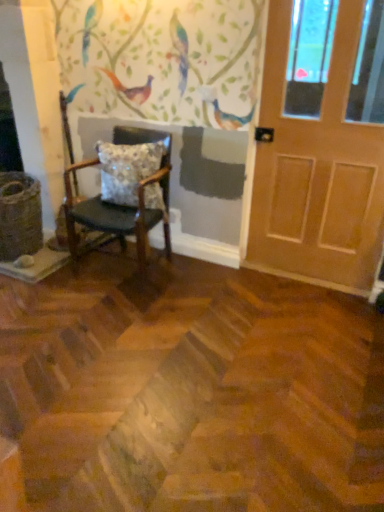
In order to click on wooden chair with cushion at left in this screenshot , I will do `click(121, 206)`.

The height and width of the screenshot is (512, 384). Find the location of `light brown wooden door at right`. light brown wooden door at right is located at coordinates (x=317, y=172).

Is the position of light brown wooden door at right less distant than that of wooden chair with cushion at left?

Yes, light brown wooden door at right is closer to the camera.

Is wooden chair with cushion at left at the back of light brown wooden door at right?

No, light brown wooden door at right's orientation is not away from wooden chair with cushion at left.

In the scene shown: Is light brown wooden door at right taller than wooden chair with cushion at left?

Indeed, light brown wooden door at right has a greater height compared to wooden chair with cushion at left.

Which object is positioned more to the right, light brown wooden door at right or wooden chair with cushion at left?

→ Positioned to the right is light brown wooden door at right.

From a real-world perspective, between wooden chair with cushion at left and floral-patterned fabric pillow at center, who is vertically lower?

wooden chair with cushion at left.

How many degrees apart are the facing directions of wooden chair with cushion at left and floral-patterned fabric pillow at center?

The angular difference between wooden chair with cushion at left and floral-patterned fabric pillow at center is 0.000318 degrees.

Consider the image. Does wooden chair with cushion at left lie behind floral-patterned fabric pillow at center?

No, it is in front of floral-patterned fabric pillow at center.

In the scene shown: Could you tell me if wooden chair with cushion at left is facing floral-patterned fabric pillow at center?

Yes, wooden chair with cushion at left is oriented towards floral-patterned fabric pillow at center.

Is floral-patterned fabric pillow at center positioned with its back to light brown wooden door at right?

No, floral-patterned fabric pillow at center is not facing away from light brown wooden door at right.

Does floral-patterned fabric pillow at center have a larger size compared to light brown wooden door at right?

No, floral-patterned fabric pillow at center is not bigger than light brown wooden door at right.

Is point (161, 146) positioned before point (257, 199)?

Yes, point (161, 146) is in front of point (257, 199).

From the image's perspective, is floral-patterned fabric pillow at center positioned above or below light brown wooden door at right?

floral-patterned fabric pillow at center is below light brown wooden door at right.

What's the angular difference between light brown wooden door at right and floral-patterned fabric pillow at center's facing directions?

The angle between the facing direction of light brown wooden door at right and the facing direction of floral-patterned fabric pillow at center is 1.77 degrees.

Find the location of `pillow below the light brown wooden door at right (from the image's perspective)`. pillow below the light brown wooden door at right (from the image's perspective) is located at coordinates (127, 169).

Would you say light brown wooden door at right is inside or outside floral-patterned fabric pillow at center?

The correct answer is: outside.

From the image's perspective, between floral-patterned fabric pillow at center and wooden chair with cushion at left, which one is located above?

floral-patterned fabric pillow at center is shown above in the image.

Could you tell me if floral-patterned fabric pillow at center is turned towards wooden chair with cushion at left?

Yes, floral-patterned fabric pillow at center faces towards wooden chair with cushion at left.

Which object is closer to the camera taking this photo, floral-patterned fabric pillow at center or wooden chair with cushion at left?

wooden chair with cushion at left.

Consider the image. From a real-world perspective, is floral-patterned fabric pillow at center above or below wooden chair with cushion at left?

In terms of real-world spatial position, floral-patterned fabric pillow at center is above wooden chair with cushion at left.

Considering the sizes of objects wooden chair with cushion at left and light brown wooden door at right in the image provided, who is taller, wooden chair with cushion at left or light brown wooden door at right?

Standing taller between the two is light brown wooden door at right.

Could you tell me if wooden chair with cushion at left is facing light brown wooden door at right?

No, wooden chair with cushion at left is not turned towards light brown wooden door at right.

In the image, there is a wooden chair with cushion at left. Identify the location of door above it (from the image's perspective). This screenshot has height=512, width=384. (317, 172).

Looking at their sizes, would you say wooden chair with cushion at left is wider or thinner than light brown wooden door at right?

Clearly, wooden chair with cushion at left has more width compared to light brown wooden door at right.

This screenshot has width=384, height=512. Find the location of `door in front of the wooden chair with cushion at left`. door in front of the wooden chair with cushion at left is located at coordinates (317, 172).

Image resolution: width=384 pixels, height=512 pixels. In order to click on pillow above the wooden chair with cushion at left (from a real-world perspective) in this screenshot , I will do point(127,169).

When comparing their distances from floral-patterned fabric pillow at center, does wooden chair with cushion at left or light brown wooden door at right seem closer?

Among the two, wooden chair with cushion at left is located nearer to floral-patterned fabric pillow at center.

When comparing their distances from floral-patterned fabric pillow at center, does light brown wooden door at right or wooden chair with cushion at left seem closer?

wooden chair with cushion at left lies closer to floral-patterned fabric pillow at center than the other object.

When comparing their distances from wooden chair with cushion at left, does light brown wooden door at right or floral-patterned fabric pillow at center seem further?

Based on the image, light brown wooden door at right appears to be further to wooden chair with cushion at left.

Which object lies nearer to the anchor point light brown wooden door at right, floral-patterned fabric pillow at center or wooden chair with cushion at left?

Based on the image, floral-patterned fabric pillow at center appears to be nearer to light brown wooden door at right.

When comparing their distances from light brown wooden door at right, does wooden chair with cushion at left or floral-patterned fabric pillow at center seem closer?

The object closer to light brown wooden door at right is floral-patterned fabric pillow at center.

Considering their positions, is floral-patterned fabric pillow at center positioned further to wooden chair with cushion at left than light brown wooden door at right?

Based on the image, light brown wooden door at right appears to be further to wooden chair with cushion at left.

Where is `pillow between wooden chair with cushion at left and light brown wooden door at right in the horizontal direction`? This screenshot has height=512, width=384. pillow between wooden chair with cushion at left and light brown wooden door at right in the horizontal direction is located at coordinates (127, 169).